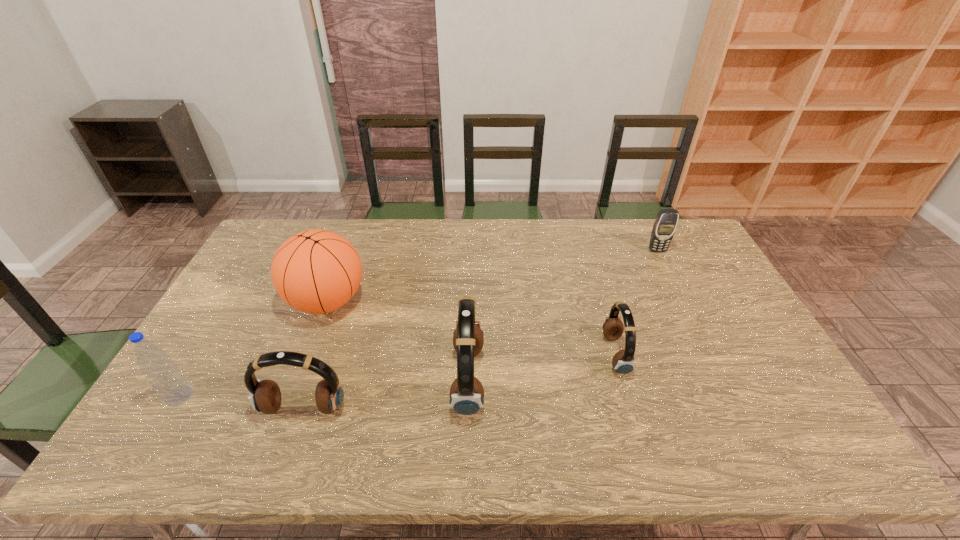
In the current image, all headsets are evenly spaced. To maintain this equal spacing, where should an additional headset be placed on the right? Please point out a free spot. Please provide its 2D coordinates. Your answer should be formatted as a tuple, i.e. [(x, y)], where the tuple contains the x and y coordinates of a point satisfying the conditions above.

[(748, 332)]